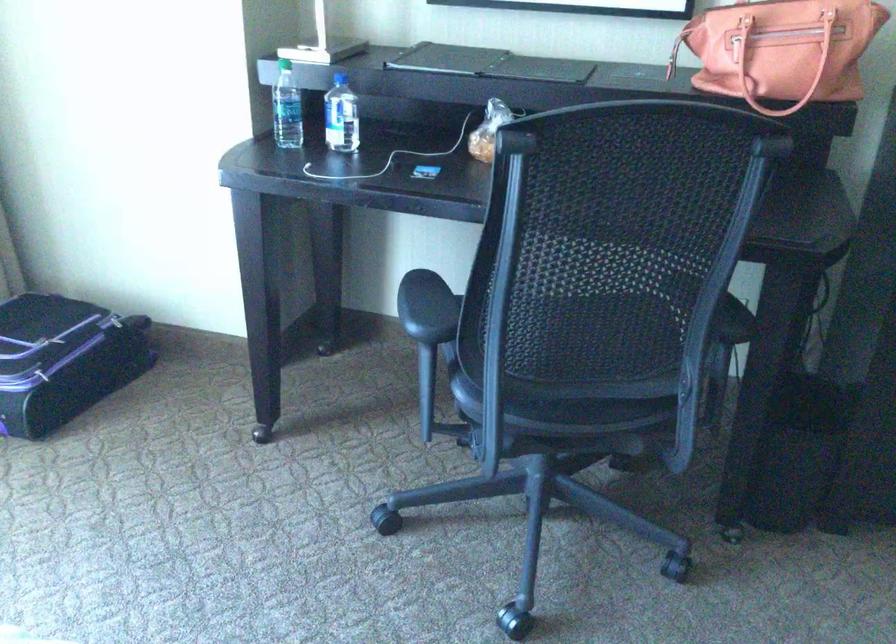
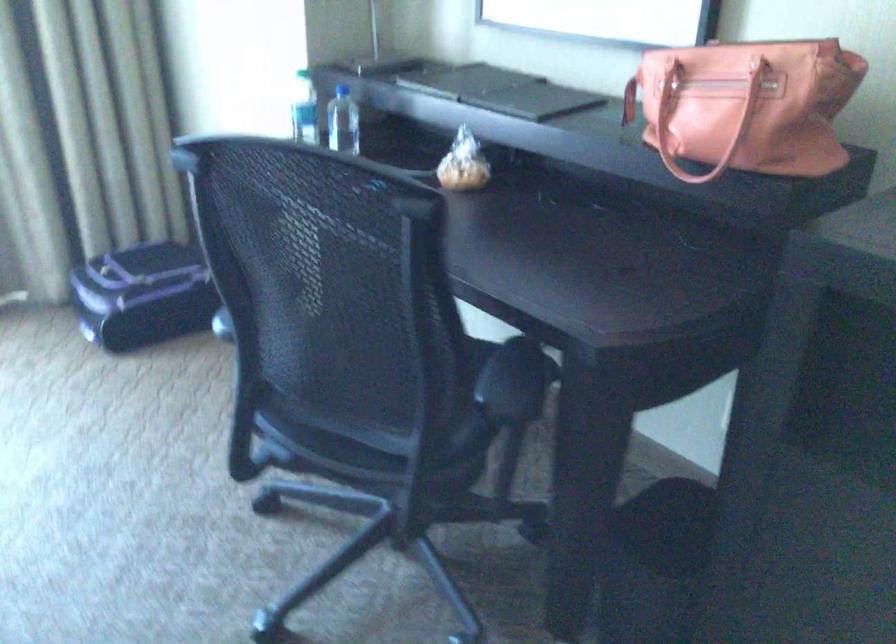
Where in the second image is the point corresponding to pixel 602 395 from the first image?

(364, 440)